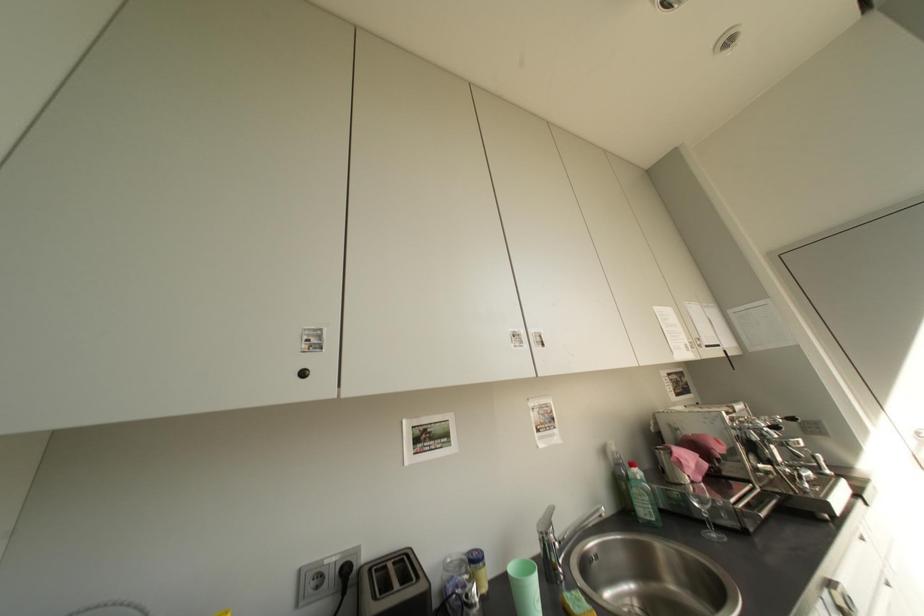
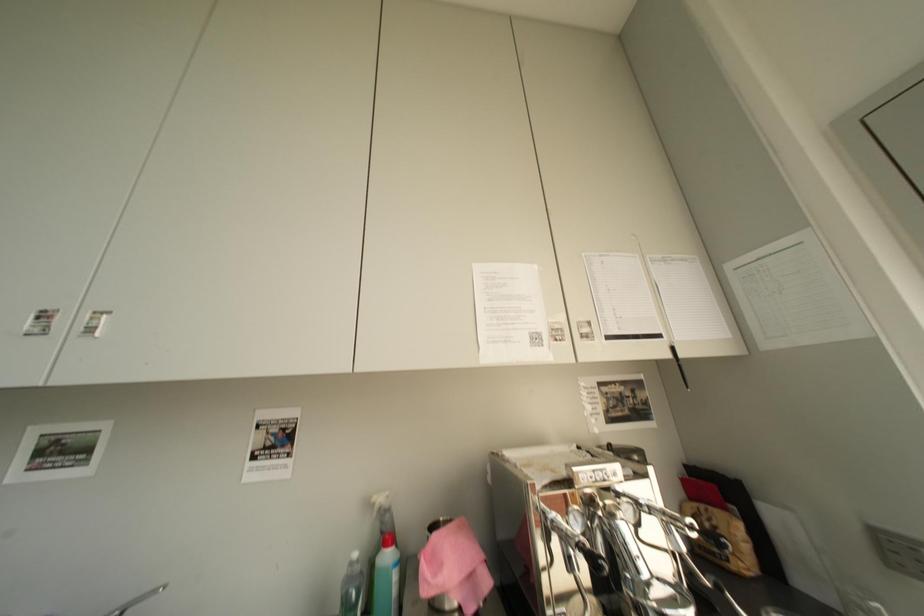
The images are taken continuously from a first-person perspective. In which direction are you moving?

The movement direction of the cameraman is right, forward.